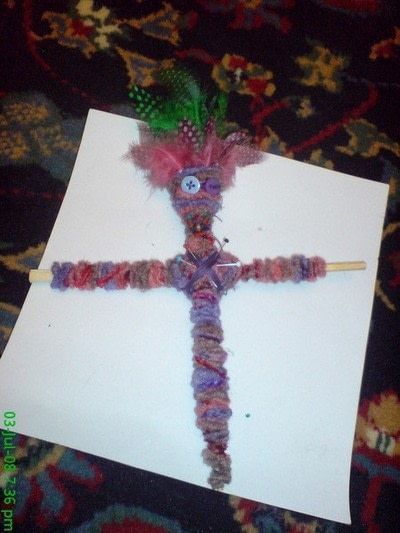
Where is `tablecloth`? The height and width of the screenshot is (533, 400). tablecloth is located at coordinates (100, 500).